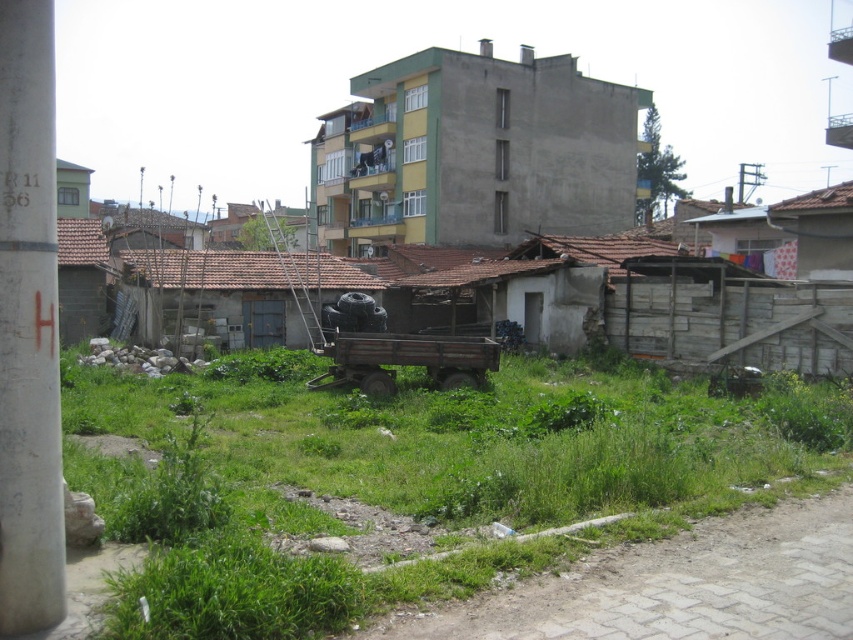
Question: Among these points, which one is nearest to the camera?

Choices:
 (A) (83, 204)
 (B) (850, 250)

Answer: (B)

Question: Is white concrete pole at left closer to camera compared to rustic wooden wagon at center?

Choices:
 (A) yes
 (B) no

Answer: (A)

Question: Considering the relative positions of concrete building at center and rustic wooden wagon at center in the image provided, where is concrete building at center located with respect to rustic wooden wagon at center?

Choices:
 (A) above
 (B) below

Answer: (A)

Question: Where is white corrugated metal hut at right located in relation to rustic wooden wagon at center in the image?

Choices:
 (A) below
 (B) above

Answer: (B)

Question: Which object is positioned farthest from the green grass at center?

Choices:
 (A) concrete building at center
 (B) rustic wooden wagon at center

Answer: (A)

Question: Which object is the farthest from the green grass at center?

Choices:
 (A) white concrete pole at left
 (B) rustic wooden wagon at center

Answer: (A)